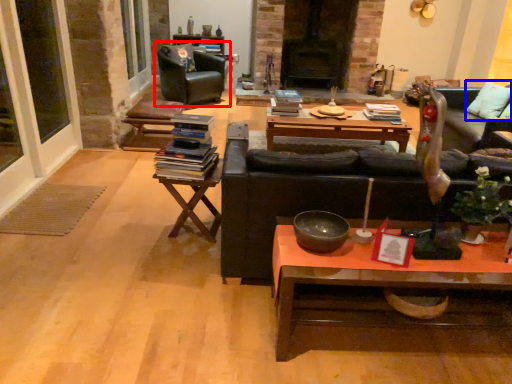
Question: Among these objects, which one is farthest to the camera, chair (highlighted by a red box) or pillow (highlighted by a blue box)?

Choices:
 (A) chair
 (B) pillow

Answer: (A)